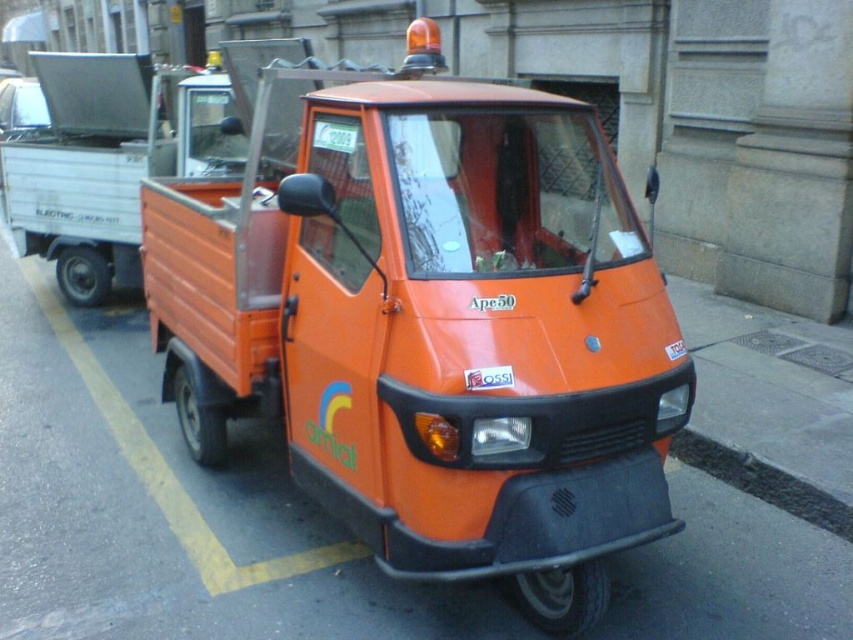
Question: Is orange matte truck at center smaller than green plastic license plate at center?

Choices:
 (A) yes
 (B) no

Answer: (B)

Question: Is orange matte truck at center further to the viewer compared to green plastic license plate at center?

Choices:
 (A) yes
 (B) no

Answer: (B)

Question: Which point appears closest to the camera in this image?

Choices:
 (A) (158, 109)
 (B) (0, 125)

Answer: (A)

Question: Does orange matte truck at center have a greater width compared to matte black truck at upper left?

Choices:
 (A) yes
 (B) no

Answer: (B)

Question: Considering the real-world distances, which object is farthest from the orange matte truck at left?

Choices:
 (A) orange matte truck at center
 (B) matte black truck at upper left

Answer: (B)

Question: Which point is farther from the camera taking this photo?

Choices:
 (A) pos(328,128)
 (B) pos(7,214)
 (C) pos(38,102)
 (D) pos(445,124)

Answer: (C)